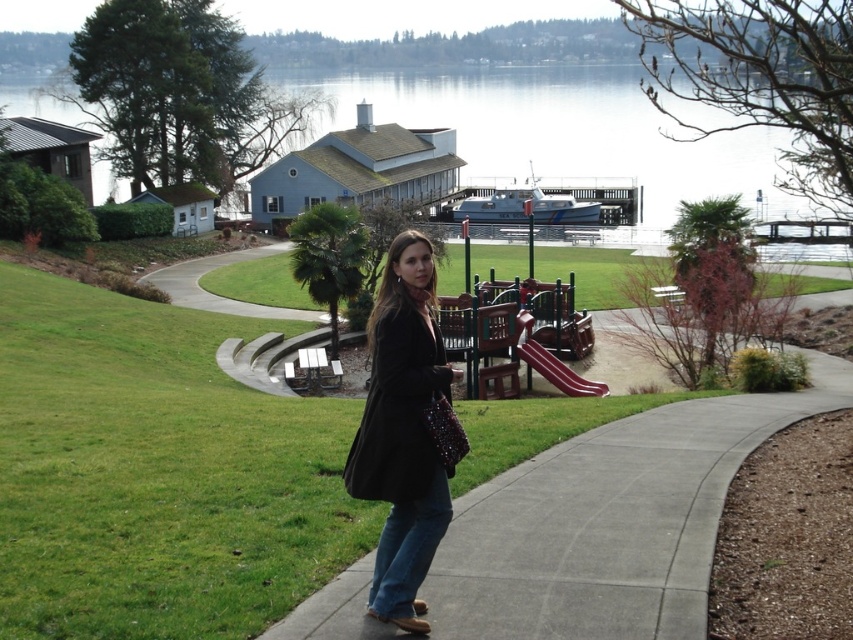
Question: Estimate the real-world distances between objects in this image. Which object is closer to the clear water at center?

Choices:
 (A) gray concrete sidewalk at center
 (B) green grass at center
 (C) black matte coat at center

Answer: (B)

Question: Is clear water at center positioned behind green grass at center?

Choices:
 (A) yes
 (B) no

Answer: (A)

Question: Which object is positioned closest to the gray concrete sidewalk at center?

Choices:
 (A) green grass at center
 (B) black matte coat at center
 (C) clear water at center

Answer: (B)

Question: Can you confirm if gray concrete sidewalk at center is positioned below green grass at center?

Choices:
 (A) no
 (B) yes

Answer: (B)

Question: Is gray concrete sidewalk at center bigger than black matte coat at center?

Choices:
 (A) yes
 (B) no

Answer: (A)

Question: Which object is farther from the camera taking this photo?

Choices:
 (A) blue denim jeans at lower center
 (B) gray concrete sidewalk at center
 (C) black matte coat at center
 (D) green grass at center

Answer: (D)